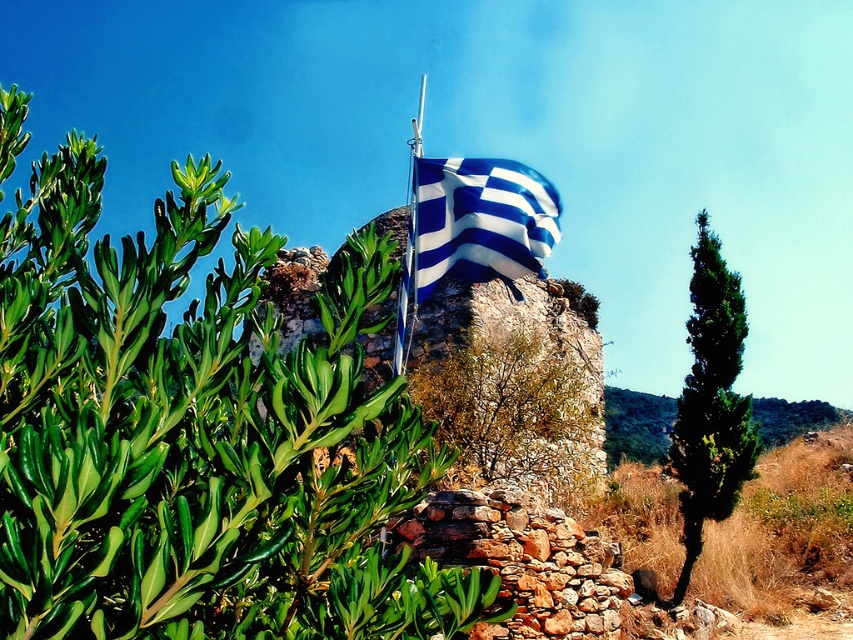
Question: Is brown dry bush at center wider than metallic flag pole at center?

Choices:
 (A) no
 (B) yes

Answer: (B)

Question: Which object is positioned closest to the brown dry bush at center?

Choices:
 (A) green coniferous tree at right
 (B) blue and white fabric flag at center

Answer: (B)

Question: Is green leafy shrub at center below metallic flag pole at center?

Choices:
 (A) yes
 (B) no

Answer: (A)

Question: Which is farther from the brown dry bush at center?

Choices:
 (A) metallic flag pole at center
 (B) green coniferous tree at right

Answer: (B)

Question: Which of the following is the closest to the observer?

Choices:
 (A) (508, 170)
 (B) (477, 355)
 (C) (331, 580)
 (D) (405, 272)

Answer: (C)

Question: Can you confirm if green leafy shrub at center is positioned to the right of metallic flag pole at center?

Choices:
 (A) yes
 (B) no

Answer: (B)